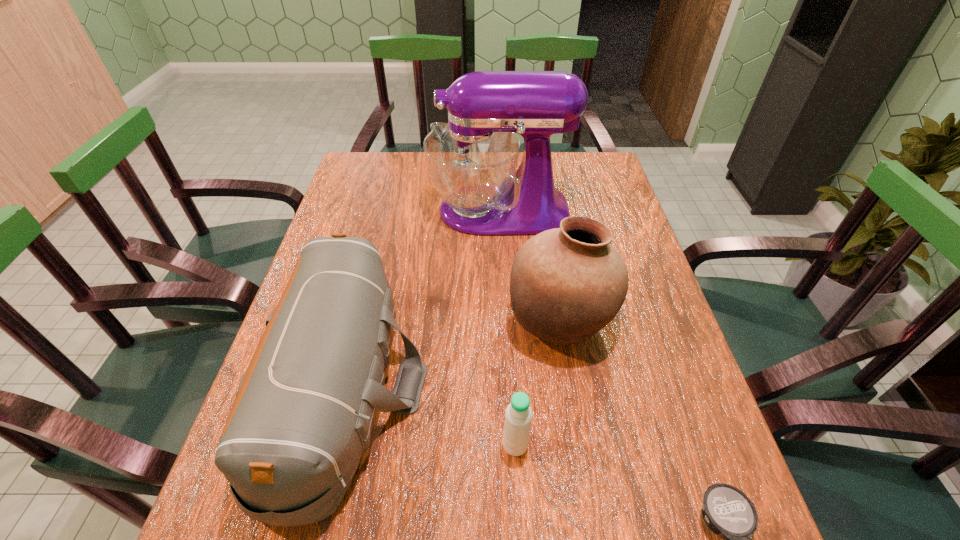
Where is `vacant area between the tallest object and the water bottle`? The width and height of the screenshot is (960, 540). vacant area between the tallest object and the water bottle is located at coordinates (507, 328).

Find the location of a particular element. vacant space that's between the third shortest object and the farthest object is located at coordinates (422, 299).

Locate an element on the screen. free space between the pottery and the duffel bag is located at coordinates (453, 354).

Image resolution: width=960 pixels, height=540 pixels. I want to click on free spot between the second tallest object and the second shortest object, so click(538, 383).

Locate an element on the screen. The height and width of the screenshot is (540, 960). object identified as the third closest to the farthest object is located at coordinates 518,415.

Point out which object is positioned as the fourth nearest to the third tallest object. Please provide its 2D coordinates. Your answer should be formatted as a tuple, i.e. [(x, y)], where the tuple contains the x and y coordinates of a point satisfying the conditions above.

[(727, 511)]

Find the location of a particular element. free location that satisfies the following two spatial constraints: 1. at the bowl opening of the water bottle; 2. on the right side of the farthest object is located at coordinates (511, 445).

Locate an element on the screen. This screenshot has height=540, width=960. vacant space that satisfies the following two spatial constraints: 1. at the bowl opening of the tallest object; 2. on the back side of the second tallest object is located at coordinates pos(505,320).